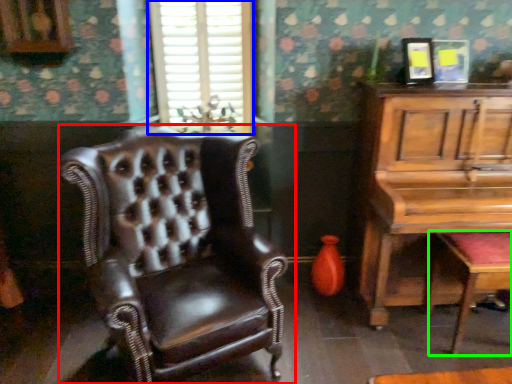
Question: Considering the real-world distances, which object is farthest from chair (highlighted by a red box)? window (highlighted by a blue box) or music stool (highlighted by a green box)?

Choices:
 (A) window
 (B) music stool

Answer: (B)